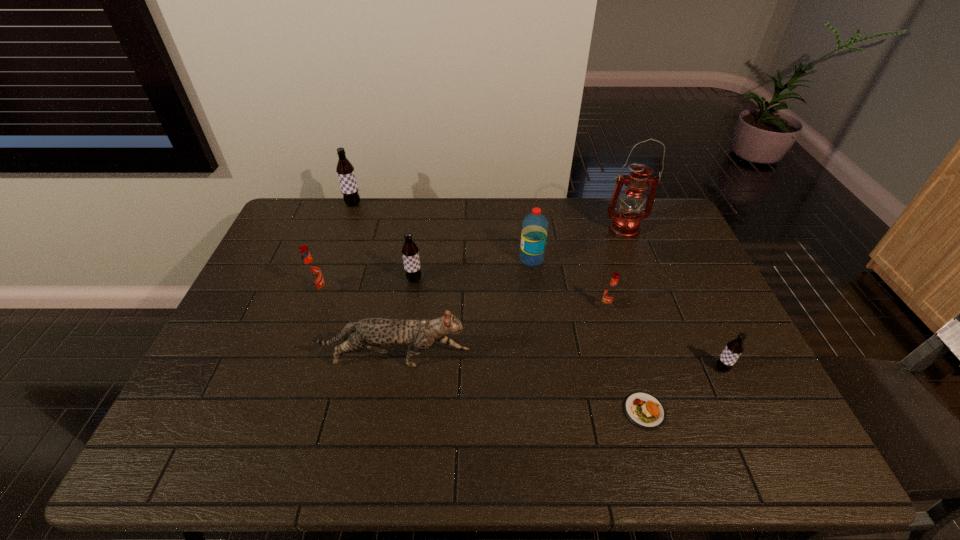
At what (x,y) coordinates should I click in order to perform the action: click on object that is positioned at the near edge. Please return your answer as a coordinate pair (x, y). Image resolution: width=960 pixels, height=540 pixels. Looking at the image, I should click on (645, 411).

Identify the location of oil lamp that is at the right edge. This screenshot has height=540, width=960. (625, 224).

Where is `root beer at the right edge`? The height and width of the screenshot is (540, 960). root beer at the right edge is located at coordinates (734, 348).

The height and width of the screenshot is (540, 960). Identify the location of object that is at the far right corner. (625, 224).

This screenshot has height=540, width=960. What are the coordinates of `vacant area at the far edge of the desktop` in the screenshot? It's located at point(561,200).

In the image, there is a desktop. Where is `vacant space at the near edge`? The width and height of the screenshot is (960, 540). vacant space at the near edge is located at coordinates (329, 430).

You are a GUI agent. You are given a task and a screenshot of the screen. Output one action in this format:
    pyautogui.click(x=<x>, y=<y>)
    Task: Click on the vacant position at the left edge of the desktop
    The width and height of the screenshot is (960, 540).
    Given the screenshot: What is the action you would take?
    pyautogui.click(x=226, y=348)

In the image, there is a desktop. Where is `free region at the right edge`? Image resolution: width=960 pixels, height=540 pixels. free region at the right edge is located at coordinates (702, 296).

This screenshot has width=960, height=540. I want to click on free region at the far left corner of the desktop, so click(x=311, y=198).

The width and height of the screenshot is (960, 540). Identify the location of vacant space at the far right corner of the desktop. (653, 213).